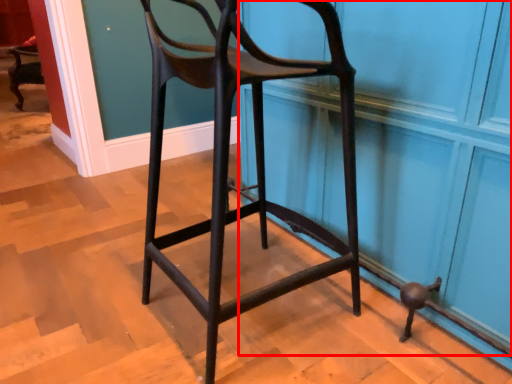
Question: From the image's perspective, what is the correct spatial positioning of screen door (annotated by the red box) in reference to chair?

Choices:
 (A) below
 (B) above

Answer: (B)